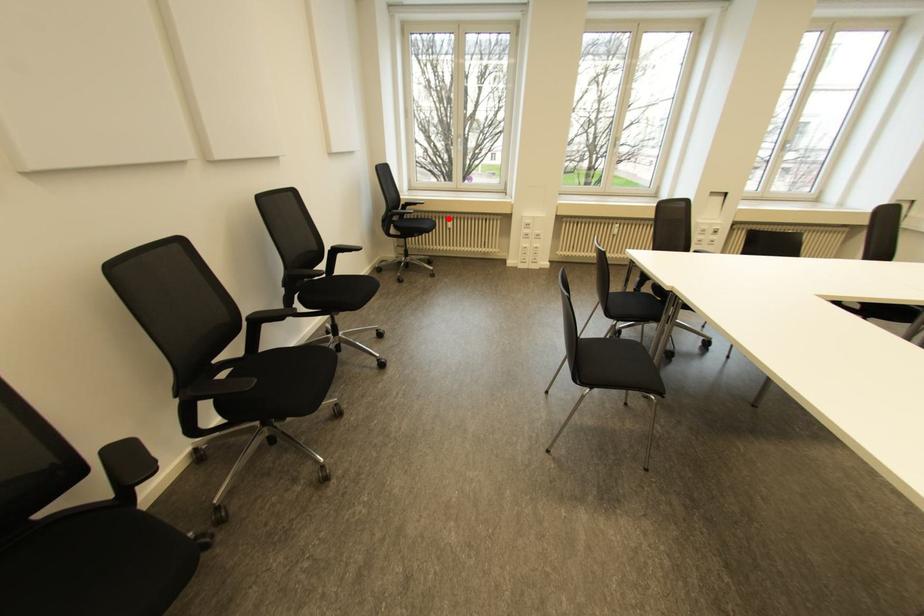
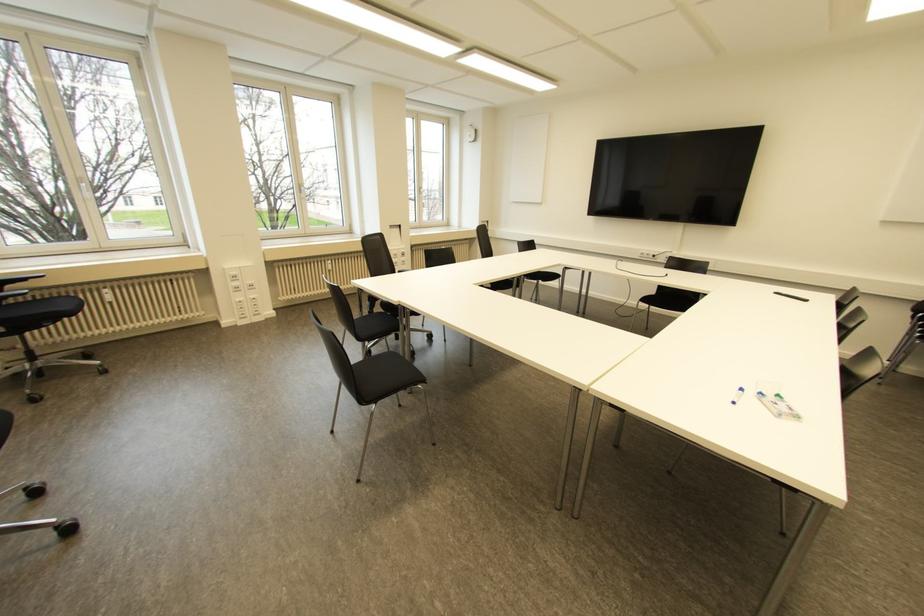
Where in the second image is the point corresponding to the highlighted location from the first image?

(104, 290)